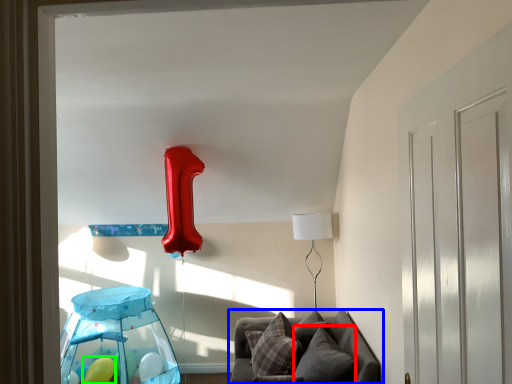
Question: Which object is the farthest from pillow (highlighted by a red box)? Choose among these: furniture (highlighted by a blue box) or balloon (highlighted by a green box).

Choices:
 (A) furniture
 (B) balloon

Answer: (B)